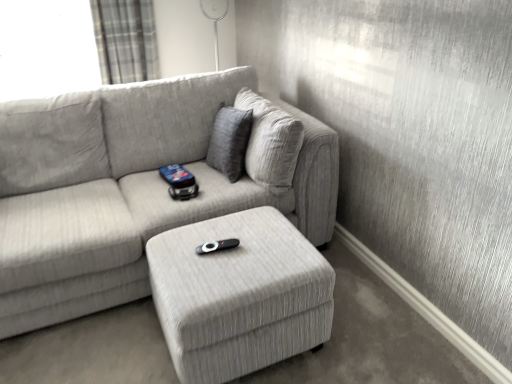
Question: In terms of height, does light gray fabric couch at center look taller or shorter compared to plaid fabric curtain at upper left?

Choices:
 (A) tall
 (B) short

Answer: (A)

Question: Is light gray fabric couch at center spatially inside plaid fabric curtain at upper left, or outside of it?

Choices:
 (A) inside
 (B) outside

Answer: (B)

Question: Which of these objects is positioned farthest from the plaid fabric curtain at upper left?

Choices:
 (A) black plastic remote at center
 (B) light gray fabric couch at center
 (C) textured gray ottoman at center

Answer: (A)

Question: Based on their relative distances, which object is nearer to the textured gray ottoman at center?

Choices:
 (A) light gray fabric couch at center
 (B) plaid fabric curtain at upper left
 (C) black plastic remote at center

Answer: (C)